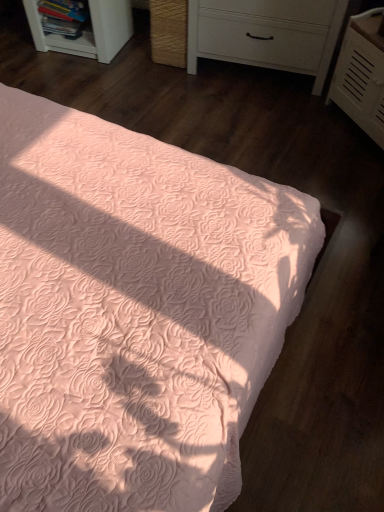
Question: From the image's perspective, is peach quilted bed at center located above white matte chest of drawers at upper center, which ranks as the first chest of drawers in left-to-right order?

Choices:
 (A) no
 (B) yes

Answer: (A)

Question: Are peach quilted bed at center and white matte chest of drawers at upper center, which ranks as the first chest of drawers in left-to-right order, far apart?

Choices:
 (A) no
 (B) yes

Answer: (B)

Question: Considering the relative sizes of peach quilted bed at center and white matte chest of drawers at upper center, which is the second chest of drawers in right-to-left order, in the image provided, is peach quilted bed at center bigger than white matte chest of drawers at upper center, which is the second chest of drawers in right-to-left order,?

Choices:
 (A) no
 (B) yes

Answer: (B)

Question: Is peach quilted bed at center directly adjacent to white matte chest of drawers at upper center, which is the second chest of drawers in right-to-left order?

Choices:
 (A) yes
 (B) no

Answer: (B)

Question: Is peach quilted bed at center closer to camera compared to white matte chest of drawers at upper center, which is the second chest of drawers in right-to-left order?

Choices:
 (A) no
 (B) yes

Answer: (B)

Question: From the image's perspective, is peach quilted bed at center below white matte chest of drawers at upper center, which ranks as the first chest of drawers in left-to-right order?

Choices:
 (A) no
 (B) yes

Answer: (B)

Question: From a real-world perspective, is white textured chest of drawers at upper right, the 2th chest of drawers in the left-to-right sequence, below white plastic shelf at upper left?

Choices:
 (A) yes
 (B) no

Answer: (B)

Question: Is white textured chest of drawers at upper right, which ranks as the 1th chest of drawers in right-to-left order, aimed at white plastic shelf at upper left?

Choices:
 (A) no
 (B) yes

Answer: (A)

Question: Considering the relative sizes of white textured chest of drawers at upper right, which ranks as the 1th chest of drawers in right-to-left order, and white plastic shelf at upper left in the image provided, is white textured chest of drawers at upper right, which ranks as the 1th chest of drawers in right-to-left order, smaller than white plastic shelf at upper left?

Choices:
 (A) no
 (B) yes

Answer: (B)

Question: From a real-world perspective, does white textured chest of drawers at upper right, the 2th chest of drawers in the left-to-right sequence, stand above white plastic shelf at upper left?

Choices:
 (A) no
 (B) yes

Answer: (B)

Question: From the image's perspective, does white textured chest of drawers at upper right, which ranks as the 1th chest of drawers in right-to-left order, appear lower than white plastic shelf at upper left?

Choices:
 (A) yes
 (B) no

Answer: (A)

Question: Is white textured chest of drawers at upper right, the 2th chest of drawers in the left-to-right sequence, to the left of white plastic shelf at upper left from the viewer's perspective?

Choices:
 (A) yes
 (B) no

Answer: (B)

Question: Does white plastic shelf at upper left lie behind peach quilted bed at center?

Choices:
 (A) yes
 (B) no

Answer: (A)